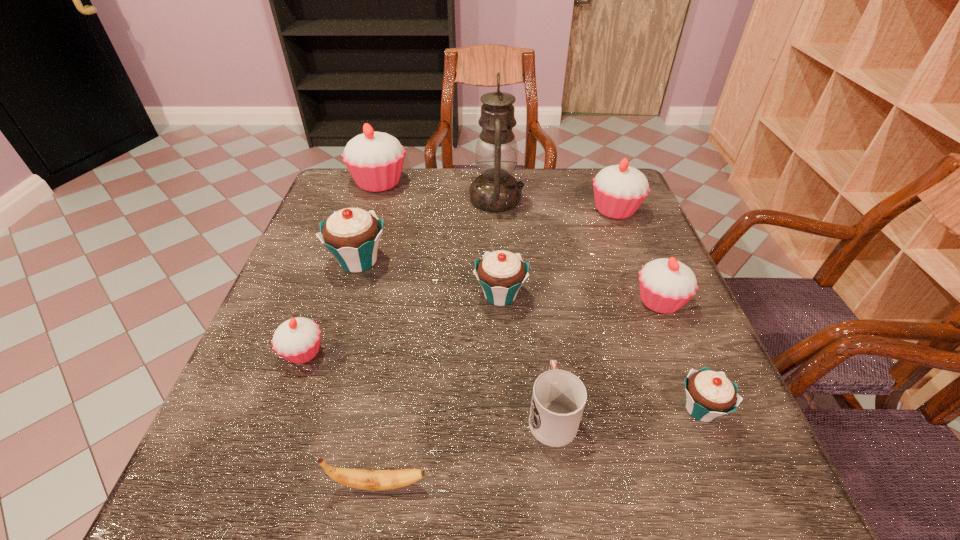
Image resolution: width=960 pixels, height=540 pixels. I want to click on object at the far right corner, so click(x=619, y=190).

This screenshot has width=960, height=540. I want to click on vacant region at the far edge of the desktop, so click(454, 185).

I want to click on vacant space at the near edge of the desktop, so click(560, 486).

Locate an element on the screen. The image size is (960, 540). free space at the left edge of the desktop is located at coordinates (314, 255).

The width and height of the screenshot is (960, 540). What are the coordinates of `free space at the right edge` in the screenshot? It's located at (590, 226).

In the image, there is a desktop. Identify the location of vacant space at the near left corner. This screenshot has width=960, height=540. pyautogui.click(x=298, y=485).

I want to click on unoccupied position between the smallest pink cupcake and the smallest teal cupcake, so click(502, 381).

I want to click on vacant space that is in between the nearest teal cupcake and the second tallest object, so click(540, 296).

This screenshot has height=540, width=960. I want to click on vacant area that lies between the red cup and the leftmost teal cupcake, so click(455, 338).

Identify the location of free spot between the nearest object and the nearest teal cupcake. The image size is (960, 540). point(540,447).